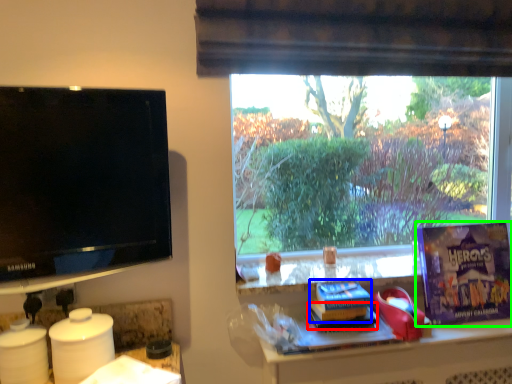
Question: Which is farther away from book (highlighted by a red box)? paperback book (highlighted by a blue box) or paperback book (highlighted by a green box)?

Choices:
 (A) paperback book
 (B) paperback book

Answer: (B)